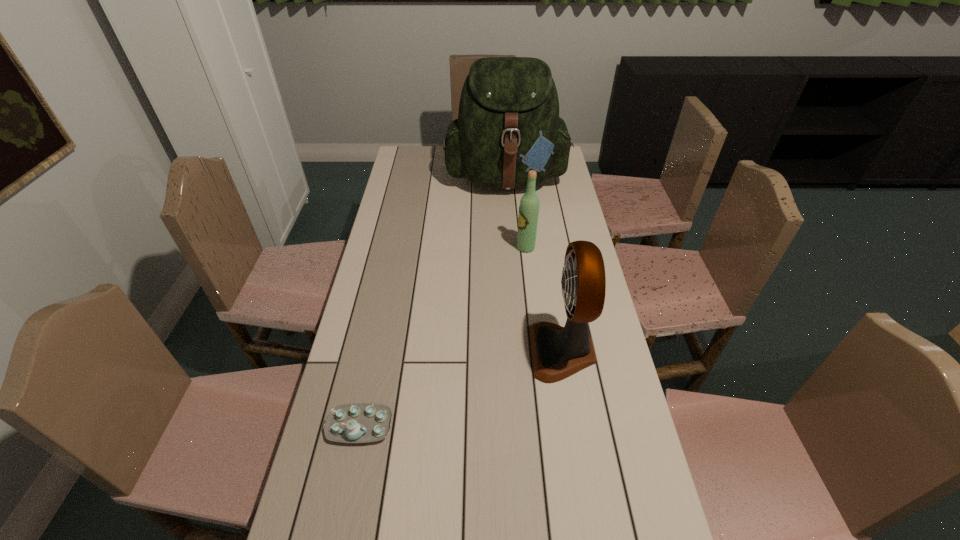
Find the location of a particular element. The image size is (960, 540). vacant space situated on the front-facing side of the second nearest object is located at coordinates (515, 351).

Identify the location of vacant space located 0.160m on the front-facing side of the second nearest object. (477, 351).

Identify the location of free spot located 0.370m on the front-facing side of the wine bottle. (417, 247).

Where is `free location located 0.150m on the front-facing side of the wine bottle`? The width and height of the screenshot is (960, 540). free location located 0.150m on the front-facing side of the wine bottle is located at coordinates [476, 247].

At what (x,y) coordinates should I click in order to perform the action: click on free spot located on the front-facing side of the wine bottle. Please return your answer as a coordinate pair (x, y). This screenshot has width=960, height=540. Looking at the image, I should click on (484, 247).

This screenshot has height=540, width=960. In order to click on vacant space located on the front of the chinaware in this screenshot , I will do `click(342, 511)`.

Image resolution: width=960 pixels, height=540 pixels. Identify the location of object located in the far edge section of the desktop. (508, 123).

Where is `object located in the left edge section of the desktop`? Image resolution: width=960 pixels, height=540 pixels. object located in the left edge section of the desktop is located at coordinates (358, 422).

In order to click on backpack positioned at the right edge in this screenshot , I will do `click(508, 123)`.

The height and width of the screenshot is (540, 960). Identify the location of fan at the right edge. (557, 352).